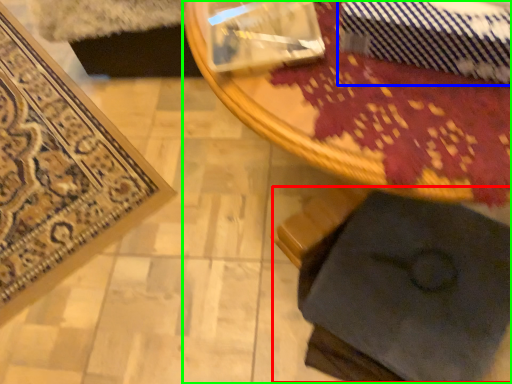
Question: Which object is the closest to the swivel chair (highlighted by a red box)? Choose among these: tie (highlighted by a blue box) or table (highlighted by a green box).

Choices:
 (A) tie
 (B) table

Answer: (B)